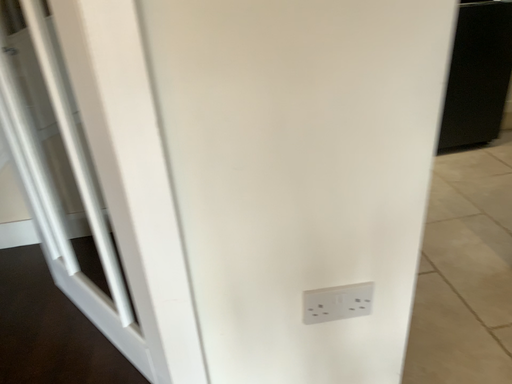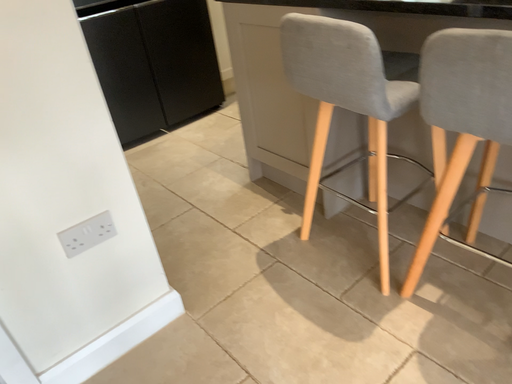
Question: Which way did the camera rotate in the video?

Choices:
 (A) rotated right
 (B) rotated left

Answer: (A)